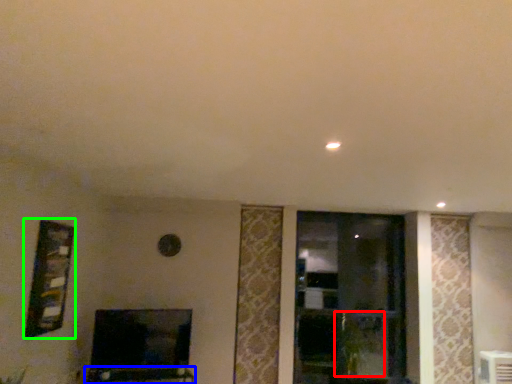
Question: Based on their relative distances, which object is farther from plant (highlighted by a red box)? Choose from furniture (highlighted by a blue box) and picture frame (highlighted by a green box).

Choices:
 (A) furniture
 (B) picture frame

Answer: (B)